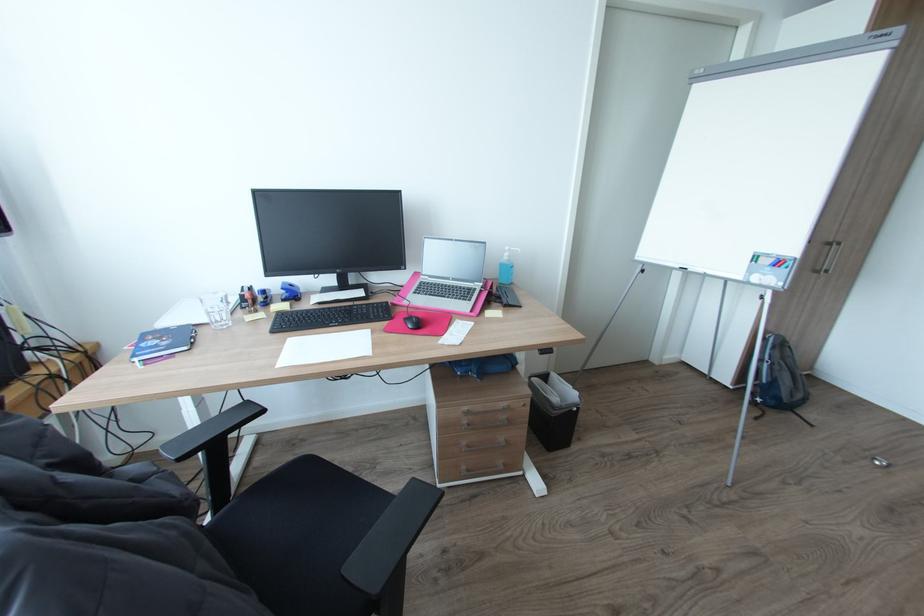
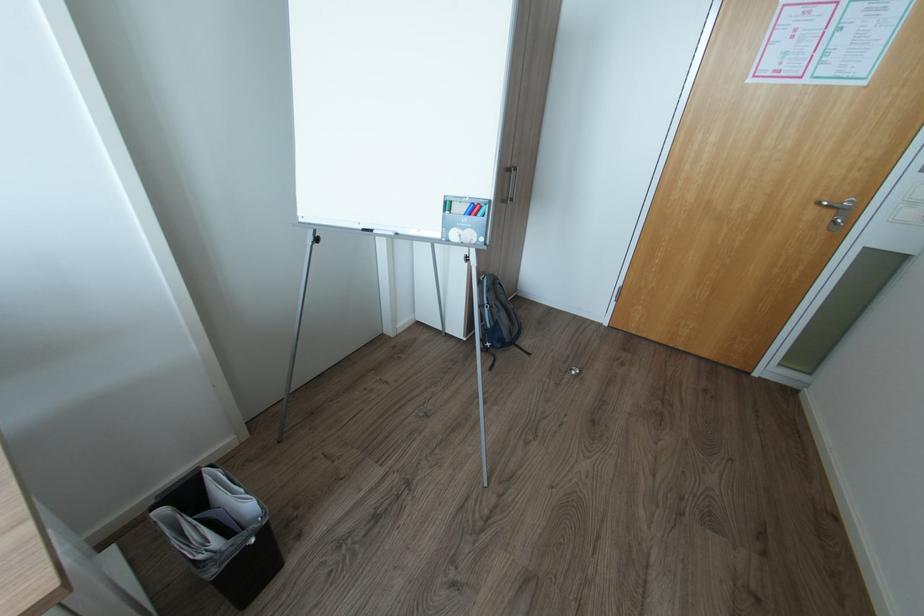
In the second image, find the point that corresponds to [693,269] in the first image.

(380, 231)